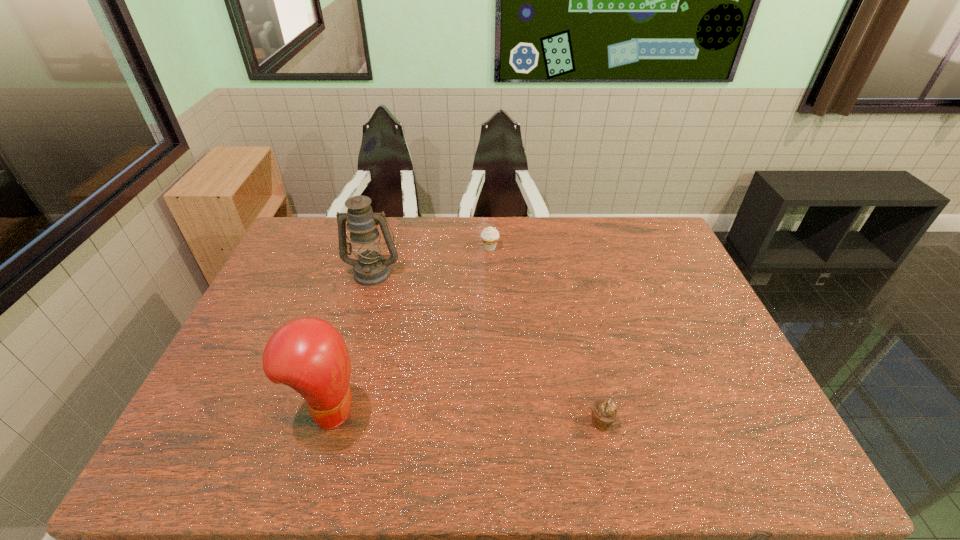
At what (x,y) coordinates should I click in order to perform the action: click on vacant space that satisfies the following two spatial constraints: 1. on the striking surface of the rightmost object; 2. on the right side of the boxing glove. Please return your answer as a coordinate pair (x, y). Looking at the image, I should click on (325, 422).

Find the location of a particular element. The image size is (960, 540). vacant region that satisfies the following two spatial constraints: 1. on the striking surface of the rightmost object; 2. on the left side of the boxing glove is located at coordinates (325, 422).

At what (x,y) coordinates should I click in order to perform the action: click on free space that satisfies the following two spatial constraints: 1. on the striking surface of the boxing glove; 2. on the back side of the rightmost object. Please return your answer as a coordinate pair (x, y). Looking at the image, I should click on (325, 422).